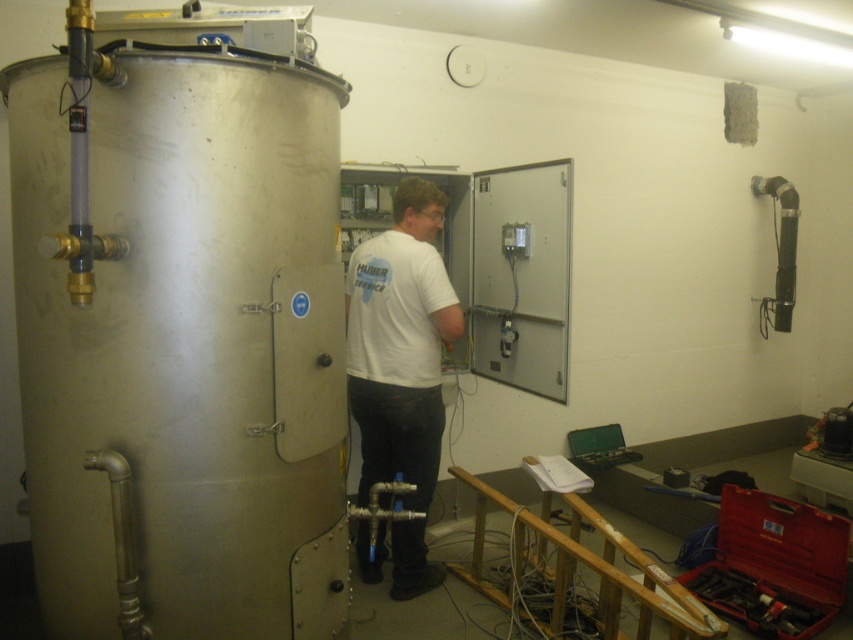
Question: Does white matte shirt at center have a lesser width compared to metallic toolbox at lower right?

Choices:
 (A) yes
 (B) no

Answer: (A)

Question: Which point is farther to the camera?

Choices:
 (A) white matte shirt at center
 (B) metallic toolbox at lower right

Answer: (A)

Question: Can you confirm if polished metallic water heater at left is smaller than metallic toolbox at lower right?

Choices:
 (A) no
 (B) yes

Answer: (A)

Question: Which point is farther to the camera?

Choices:
 (A) [381, 376]
 (B) [817, 630]
 (C) [242, 268]

Answer: (B)

Question: Can you confirm if polished metallic water heater at left is bigger than metallic toolbox at lower right?

Choices:
 (A) yes
 (B) no

Answer: (A)

Question: Among these points, which one is farthest from the camera?

Choices:
 (A) (369, 564)
 (B) (144, 342)
 (C) (741, 592)

Answer: (A)